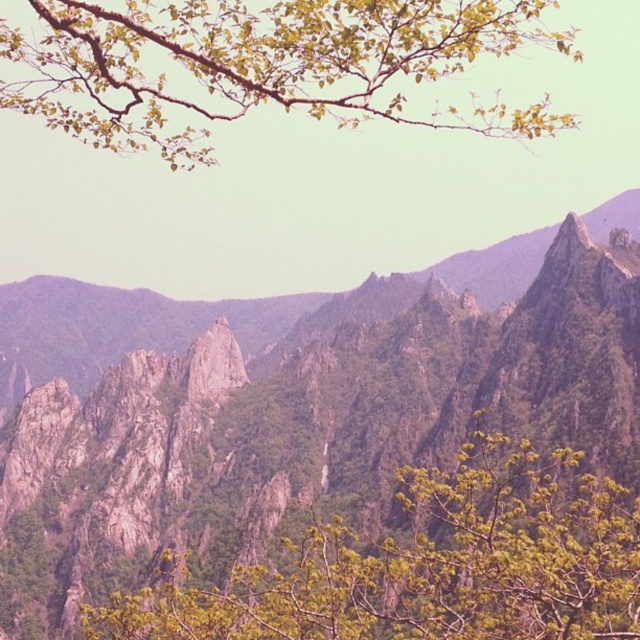
You are a photographer standing at the base of the mountains. You want to capture a photo of the green leafy tree at center in the foreground while also including the mountain peaks in the background. Based on the given information, will the tree be in focus if you focus on the mountains?

The green leafy tree at center is 193.16 feet away from the camera. If you focus on the mountains, which are much farther away, the tree may not be in focus because it is relatively closer than the mountains. To have both in focus, you would need to use a small aperture for greater depth of field.

You are an outdoor photographer planning to capture a landscape shot that includes both the rugged stone mountains at center and the green leafy branch at upper center. Given their distance apart, can you estimate whether a standard camera lens can easily frame both subjects in a single shot without needing to adjust your position?

The rugged stone mountains at center and green leafy branch at upper center are 37.00 meters apart. A standard camera lens typically has a field of view wide enough to capture both subjects in a single shot from this distance without needing to move, provided the photographer positions themselves appropriately.

You are standing in a scenic mountain area with a point marked at coordinates (308, 408). According to the image, what does this point indicate?

The point at (308, 408) marks the rugged stone mountains at center.